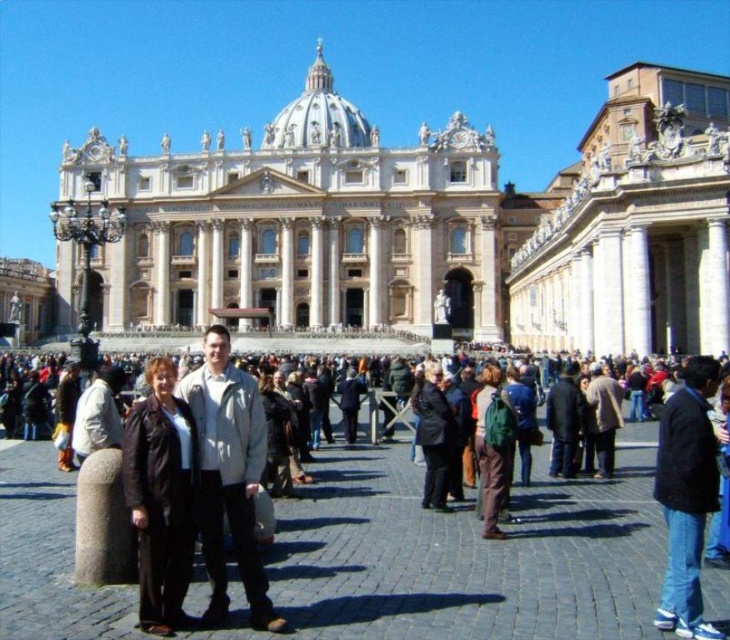
You are a photographer trying to capture the grandeur of the white marble palace at center while including the dark blue jeans at center in the frame. Given their relative heights, which object should you focus on first to ensure both are in the shot?

The white marble palace at center is taller than the dark blue jeans at center, so you should focus on the white marble palace at center first to ensure both are in the shot.

You are a photographer standing in the plaza at St. Peter Basilica. You see the dark clothing crowd at center and the dark blue jeans at center. Which one is taller?

The dark blue jeans at center is taller than the dark clothing crowd at center.